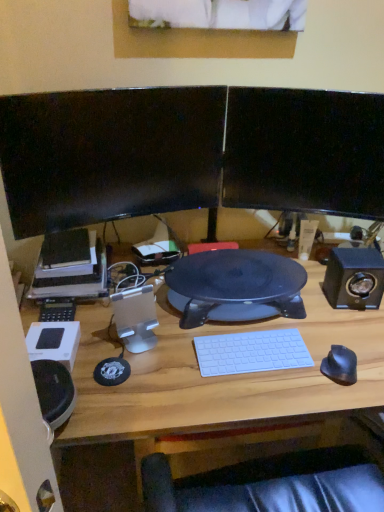
This screenshot has height=512, width=384. In order to click on vacant area that is in front of black matte speaker at right, which ranks as the 2th speaker in left-to-right order in this screenshot , I will do `click(350, 330)`.